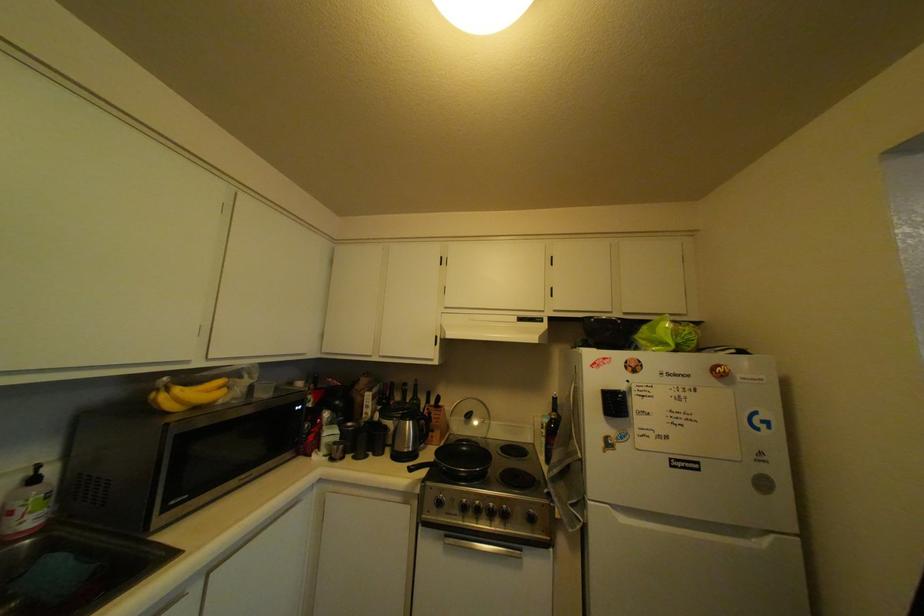
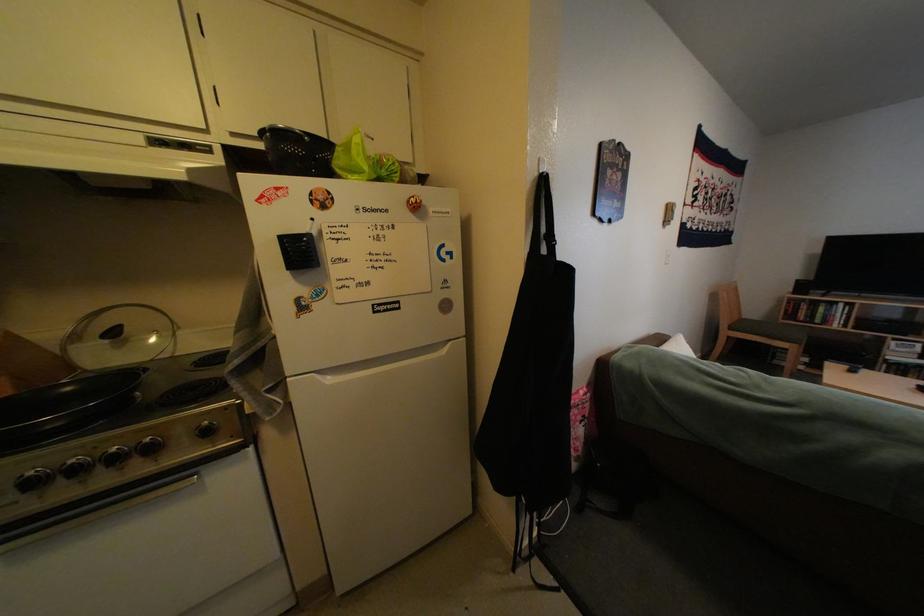
First-person continuous shooting, in which direction is the camera rotating?

The camera's rotation is toward right-down.